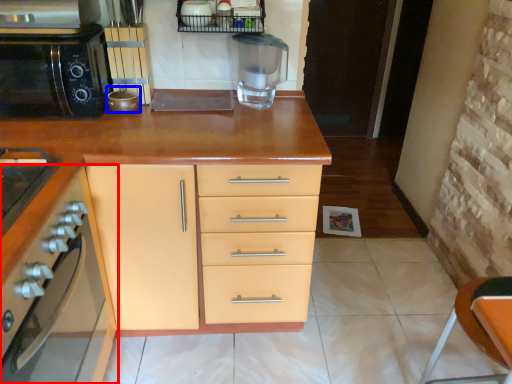
Question: Which point is further to the camera, cabinetry (highlighted by a red box) or appliance (highlighted by a blue box)?

Choices:
 (A) cabinetry
 (B) appliance

Answer: (B)